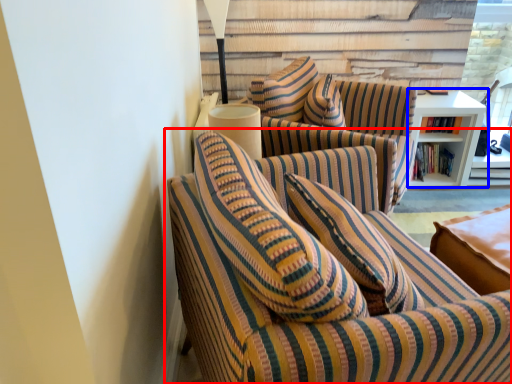
Question: Which point is further to the camera, studio couch (highlighted by a red box) or table (highlighted by a blue box)?

Choices:
 (A) studio couch
 (B) table

Answer: (B)